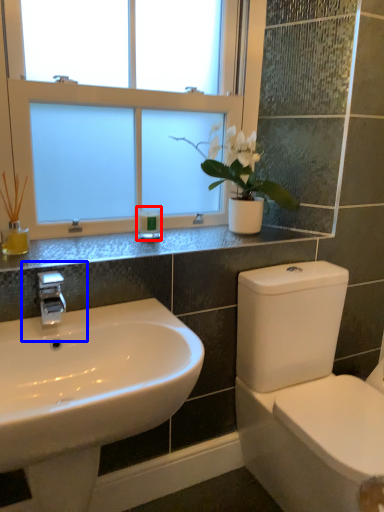
Question: Which object appears farthest to the camera in this image, toiletry (highlighted by a red box) or plumbing fixture (highlighted by a blue box)?

Choices:
 (A) toiletry
 (B) plumbing fixture

Answer: (A)